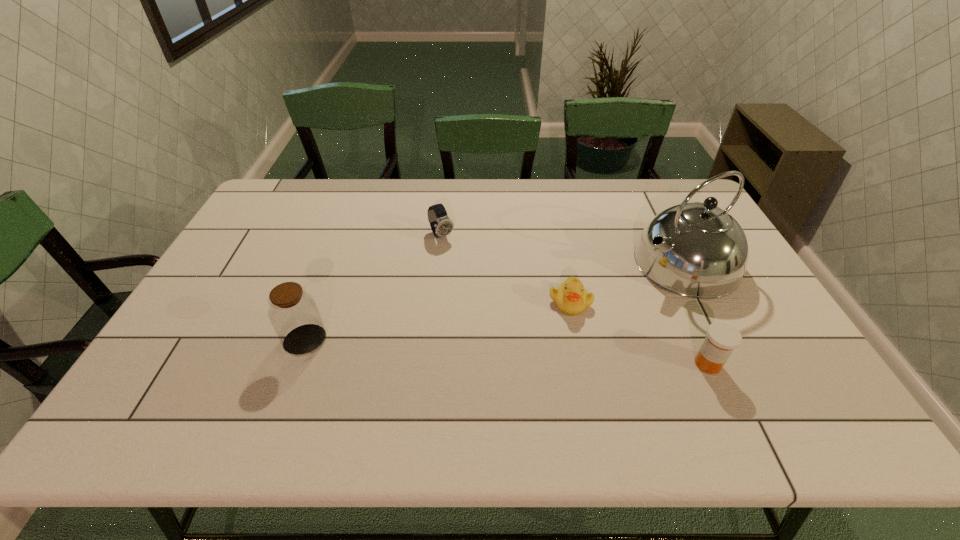
Find the location of a particular element. the fourth shortest object is located at coordinates (293, 312).

Image resolution: width=960 pixels, height=540 pixels. In order to click on the leftmost object in this screenshot , I will do `click(293, 312)`.

Locate an element on the screen. medicine is located at coordinates (722, 338).

Locate an element on the screen. This screenshot has height=540, width=960. the third object from left to right is located at coordinates (571, 297).

Where is `duckling`? The width and height of the screenshot is (960, 540). duckling is located at coordinates (571, 297).

Where is `the second object from left to right`? the second object from left to right is located at coordinates (441, 225).

This screenshot has height=540, width=960. I want to click on kettle, so [x=697, y=250].

At what (x,y) coordinates should I click in order to perform the action: click on free location located 0.400m on the back of the jar. Please return your answer as a coordinate pair (x, y). The width and height of the screenshot is (960, 540). Looking at the image, I should click on (346, 231).

At what (x,y) coordinates should I click in order to perform the action: click on vacant space located on the label of the medicine. Please return your answer as a coordinate pair (x, y). Looking at the image, I should click on (580, 364).

You are a GUI agent. You are given a task and a screenshot of the screen. Output one action in this format:
    pyautogui.click(x=<x>, y=<y>)
    Task: Click on the free space located 0.050m on the label of the medicine
    
    Given the screenshot: What is the action you would take?
    pyautogui.click(x=672, y=364)